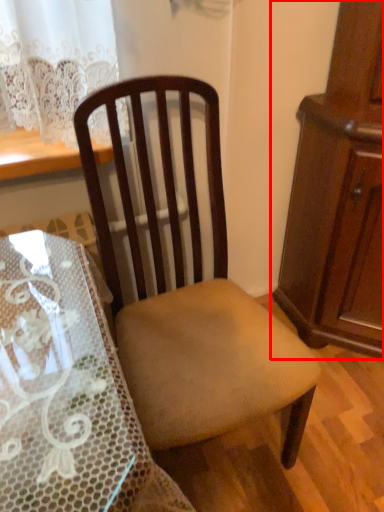
Question: Observing the image, what is the correct spatial positioning of cabinetry (annotated by the red box) in reference to chair?

Choices:
 (A) left
 (B) right

Answer: (B)